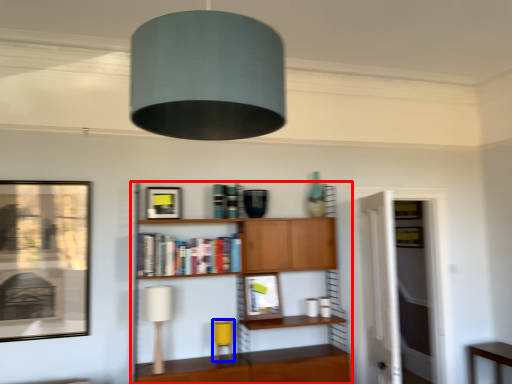
Question: Which point is closer to the camera, shelf (highlighted by a red box) or table lamp (highlighted by a blue box)?

Choices:
 (A) shelf
 (B) table lamp

Answer: (A)